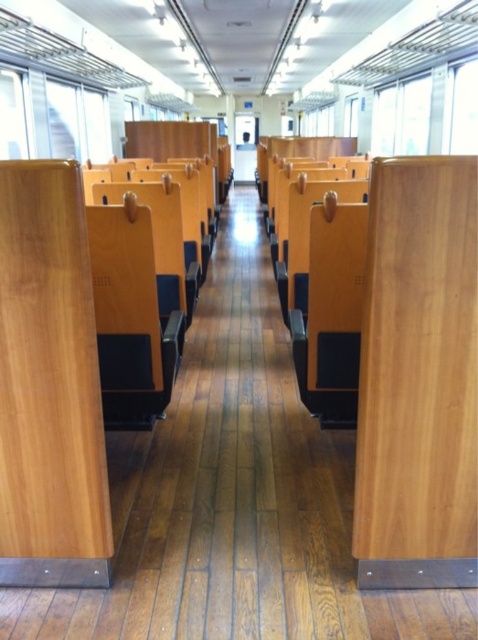
Question: Does wooden chair at center appear on the right side of wooden seat at center?

Choices:
 (A) yes
 (B) no

Answer: (B)

Question: Which of the following is the farthest from the observer?

Choices:
 (A) (333, 291)
 (B) (144, 230)

Answer: (A)

Question: Can you confirm if wooden chair at center is positioned to the right of wooden seat at center?

Choices:
 (A) yes
 (B) no

Answer: (B)

Question: Does wooden chair at center lie in front of wooden seat at center?

Choices:
 (A) yes
 (B) no

Answer: (B)